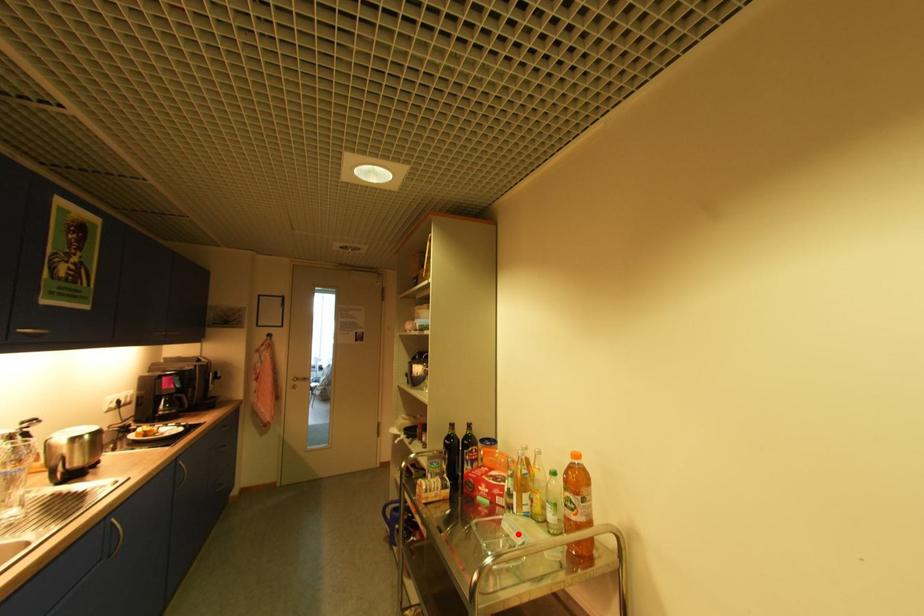
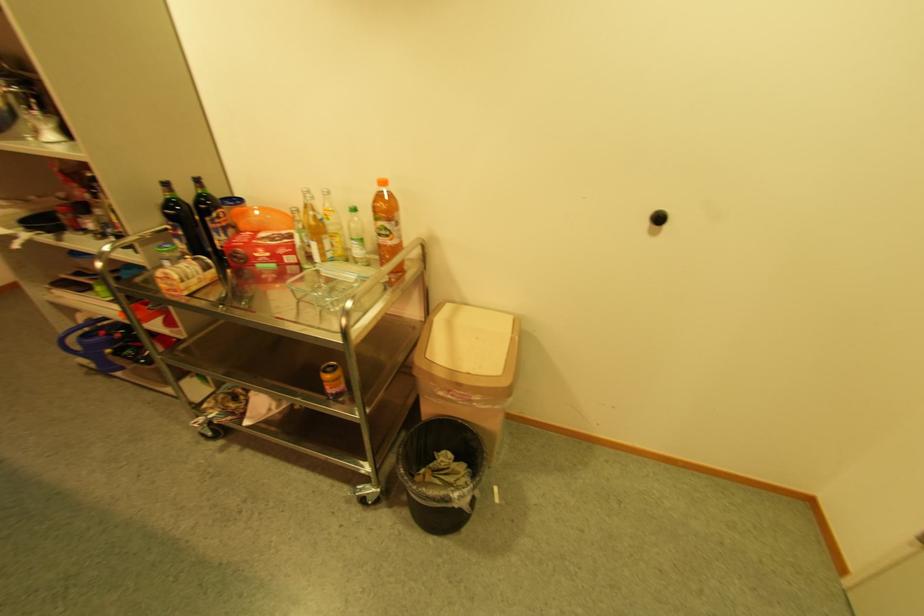
The point at the highlighted location is marked in the first image. Where is the corresponding point in the second image?

(344, 278)